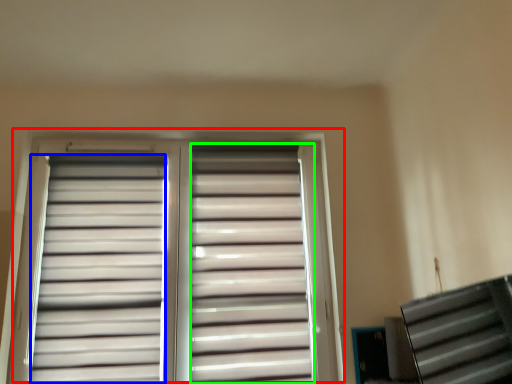
Question: Which object is the farthest from window (highlighted by a red box)? Choose among these: shutter (highlighted by a blue box) or shutter (highlighted by a green box).

Choices:
 (A) shutter
 (B) shutter

Answer: (B)